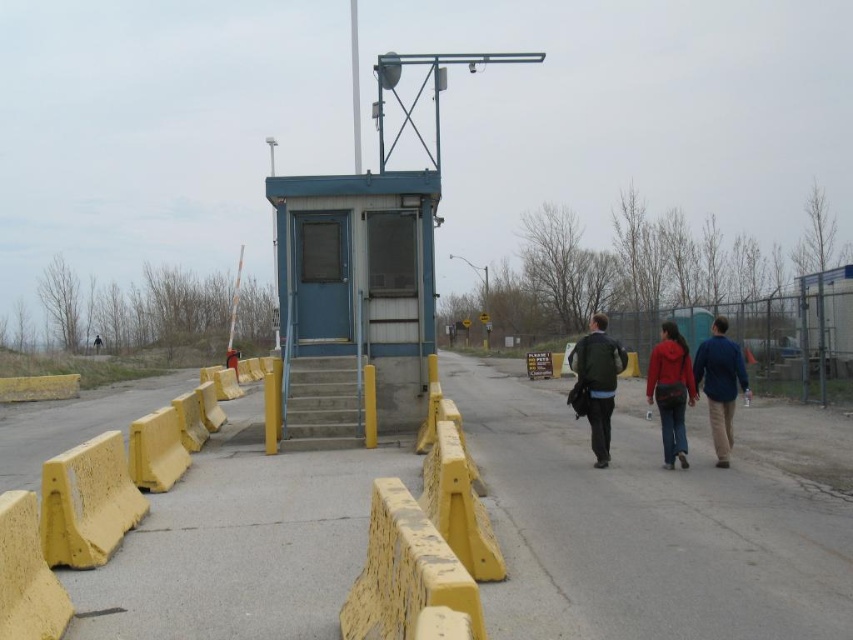
You are a pedestrian standing at the checkpoint area. You see a matte red hoodie at center and a blue fabric jacket at right. If you want to pick up both items, which one should you reach for first to minimize the distance you need to walk?

You should reach for the matte red hoodie at center first because it is closer to your current position than the blue fabric jacket at right, as the distance between them is 34.11 inches.

You are a traveler standing at the checkpoint and see the yellow concrete stairs at center and the dark green jacket at center. Which object is shorter in height?

The yellow concrete stairs at center is not as tall as the dark green jacket at center, so the yellow concrete stairs at center is shorter in height.